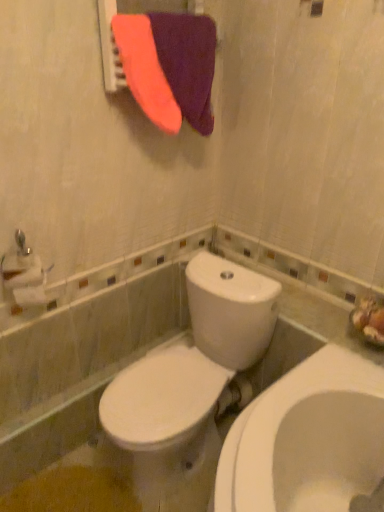
Question: Should I look upward or downward to see purple fabric at upper center?

Choices:
 (A) up
 (B) down

Answer: (A)

Question: Can you confirm if purple fabric at upper center is positioned to the left of white glossy toilet at center?

Choices:
 (A) no
 (B) yes

Answer: (B)

Question: Is the position of purple fabric at upper center less distant than that of white glossy toilet at center?

Choices:
 (A) yes
 (B) no

Answer: (B)

Question: Is purple fabric at upper center looking in the opposite direction of white glossy toilet at center?

Choices:
 (A) no
 (B) yes

Answer: (A)

Question: Considering the relative sizes of purple fabric at upper center and white glossy toilet at center in the image provided, is purple fabric at upper center shorter than white glossy toilet at center?

Choices:
 (A) no
 (B) yes

Answer: (B)

Question: Is purple fabric at upper center far away from white glossy toilet at center?

Choices:
 (A) yes
 (B) no

Answer: (B)

Question: Would you say purple fabric at upper center is outside white glossy toilet at center?

Choices:
 (A) yes
 (B) no

Answer: (A)

Question: Is white glossy toilet at center beside purple soft towel at upper center?

Choices:
 (A) yes
 (B) no

Answer: (B)

Question: Can you confirm if white glossy toilet at center is positioned to the right of purple soft towel at upper center?

Choices:
 (A) yes
 (B) no

Answer: (B)

Question: Does white glossy toilet at center come behind purple soft towel at upper center?

Choices:
 (A) no
 (B) yes

Answer: (A)

Question: From the image's perspective, is white glossy toilet at center under purple soft towel at upper center?

Choices:
 (A) no
 (B) yes

Answer: (B)

Question: Does white glossy toilet at center have a greater height compared to purple soft towel at upper center?

Choices:
 (A) no
 (B) yes

Answer: (B)

Question: Does white glossy toilet at center have a lesser width compared to purple soft towel at upper center?

Choices:
 (A) yes
 (B) no

Answer: (B)

Question: Is white matte toilet paper at left smaller than purple fabric at upper center?

Choices:
 (A) no
 (B) yes

Answer: (B)